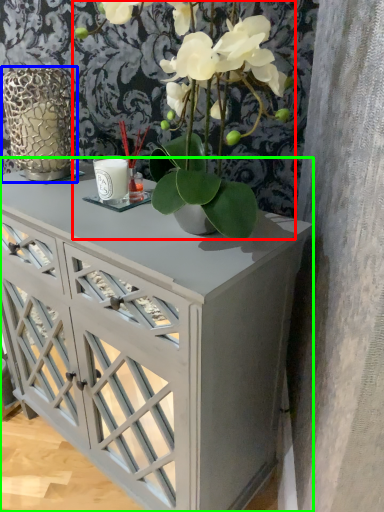
Question: Estimate the real-world distances between objects in this image. Which object is farther from houseplant (highlighted by a red box), glass vase (highlighted by a blue box) or table (highlighted by a green box)?

Choices:
 (A) glass vase
 (B) table

Answer: (A)